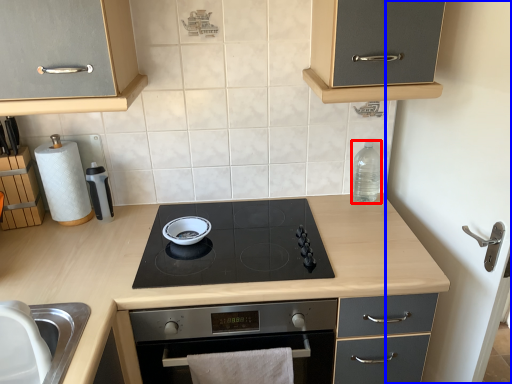
Question: Which point is further to the camera, bottle (highlighted by a red box) or side (highlighted by a blue box)?

Choices:
 (A) bottle
 (B) side

Answer: (A)